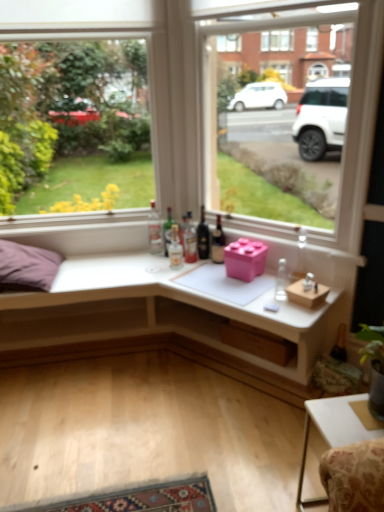
Where is `free space between translucent glass bottle at center, acting as the fourth bottle starting from the left, and pink matte plastic cube at center, positioned as the third window box in bottom-to-top order`? This screenshot has width=384, height=512. free space between translucent glass bottle at center, acting as the fourth bottle starting from the left, and pink matte plastic cube at center, positioned as the third window box in bottom-to-top order is located at coordinates (207, 268).